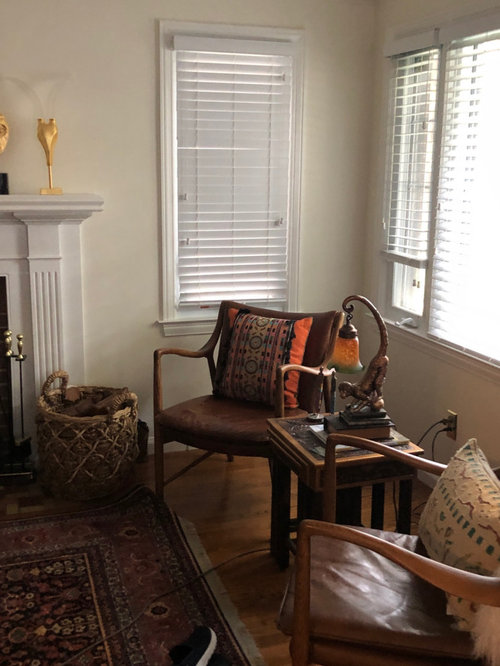
The width and height of the screenshot is (500, 666). Identify the location of pillows. 458,541, 256,368.